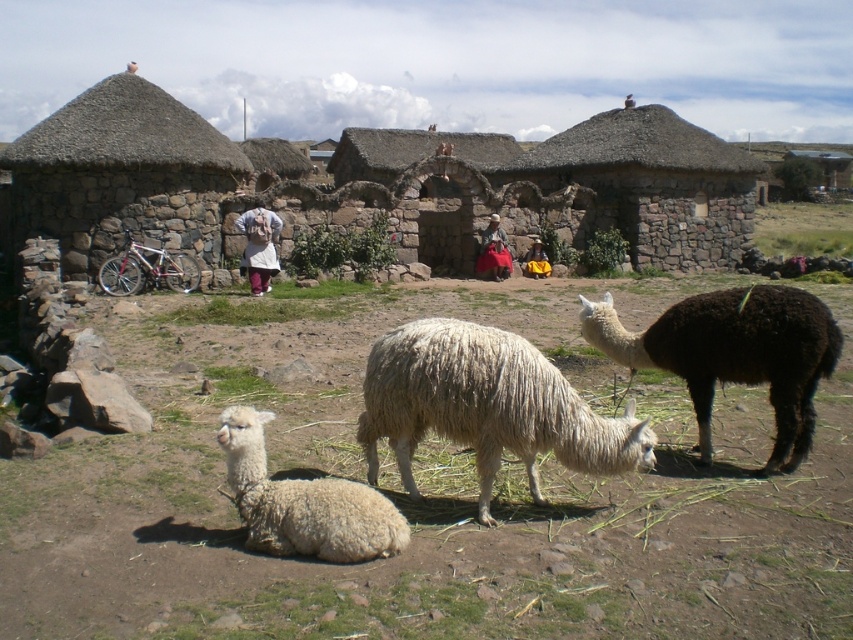
You are standing in the rural scene described. You want to find the black woolly alpaca at right. Which direction should you look to locate it?

The black woolly alpaca at right is located at the coordinates (734, 353), so you should look to the right side of the scene to find it.

You are a hiker carrying a backpack and want to take a photo of the black woolly alpaca at right and the white woolen sweater at center. To ensure both fit in the frame, which object should you position closer to the camera?

The black woolly alpaca at right might be wider than the white woolen sweater at center, so you should position the black woolly alpaca at right closer to the camera to ensure both fit in the frame.